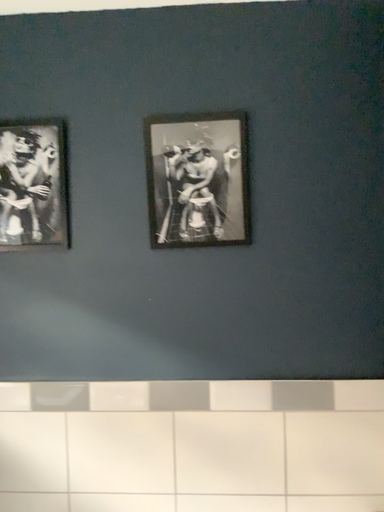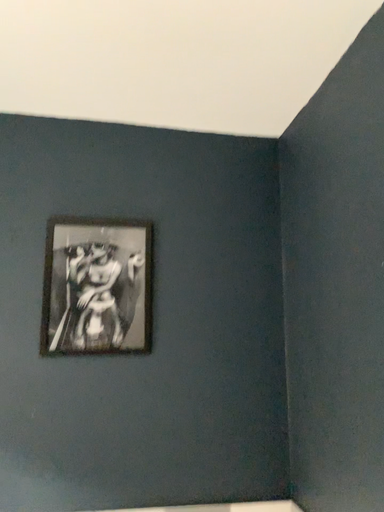
Question: How did the camera likely rotate when shooting the video?

Choices:
 (A) rotated right
 (B) rotated left

Answer: (A)